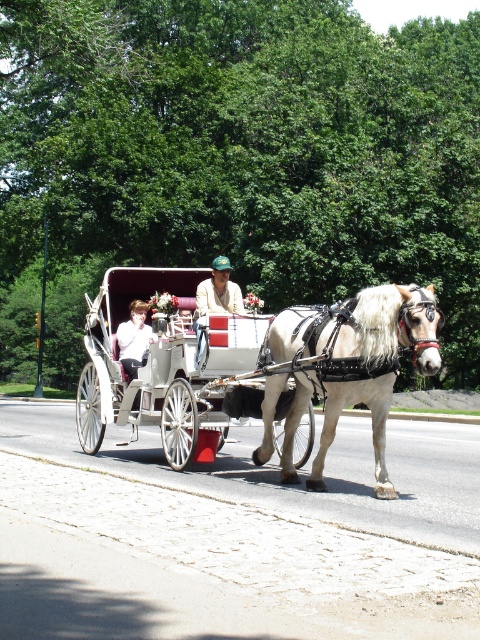
You are a photographer trying to capture a photo of the white glossy horse at center and the light brown leather jacket at center in the carriage scene. Which object should you focus on first if you want to highlight the taller one in your photo?

The light brown leather jacket at center is taller than the white glossy horse at center, so you should focus on the light brown leather jacket at center first to highlight its height.

You are a photographer trying to capture a clear photo of the white cotton shirt at center and the white glossy horse at center. Since both are white, you need to adjust your camera settings to account for their size difference. Which object should you focus on first to ensure proper exposure, considering their sizes?

The white glossy horse at center is bigger than the white cotton shirt at center, so you should focus on the white glossy horse at center first to ensure proper exposure, as larger objects may require different lighting adjustments.

You are a delivery person who needs to place a package between the white glossy horse at center and the white cotton shirt at center. The package requires a space of 3 meters to fit. Can you place the package there?

The distance between the white glossy horse at center and the white cotton shirt at center is 2.78 meters, which is less than the required 3 meters. Therefore, the package cannot be placed there.